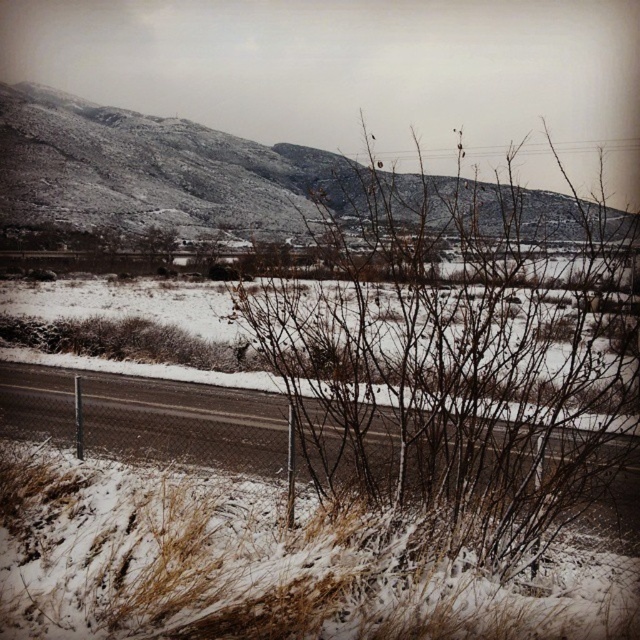
Does brown/dry branches at center have a greater height compared to gray asphalt highway at center?

Correct, brown/dry branches at center is much taller as gray asphalt highway at center.

Consider the image. Does brown/dry branches at center appear on the left side of gray asphalt highway at center?

In fact, brown/dry branches at center is to the right of gray asphalt highway at center.

Locate an element on the screen. The image size is (640, 640). brown/dry branches at center is located at coordinates (458, 360).

At what (x,y) coordinates should I click in order to perform the action: click on brown/dry branches at center. Please return your answer as a coordinate pair (x, y). Looking at the image, I should click on coord(458,360).

Between point (115, 173) and point (40, 380), which one is positioned in front?

Point (40, 380)

Does point (54, 138) lie behind point (260, 410)?

Yes, point (54, 138) is behind point (260, 410).

Locate an element on the screen. The width and height of the screenshot is (640, 640). snow-covered mountain at upper center is located at coordinates (156, 170).

Measure the distance between point (x=429, y=349) and camera.

8.26 meters

Between brown/dry branches at center and snow-covered mountain at upper center, which one appears on the right side from the viewer's perspective?

brown/dry branches at center

The image size is (640, 640). Find the location of `brown/dry branches at center`. brown/dry branches at center is located at coordinates tap(458, 360).